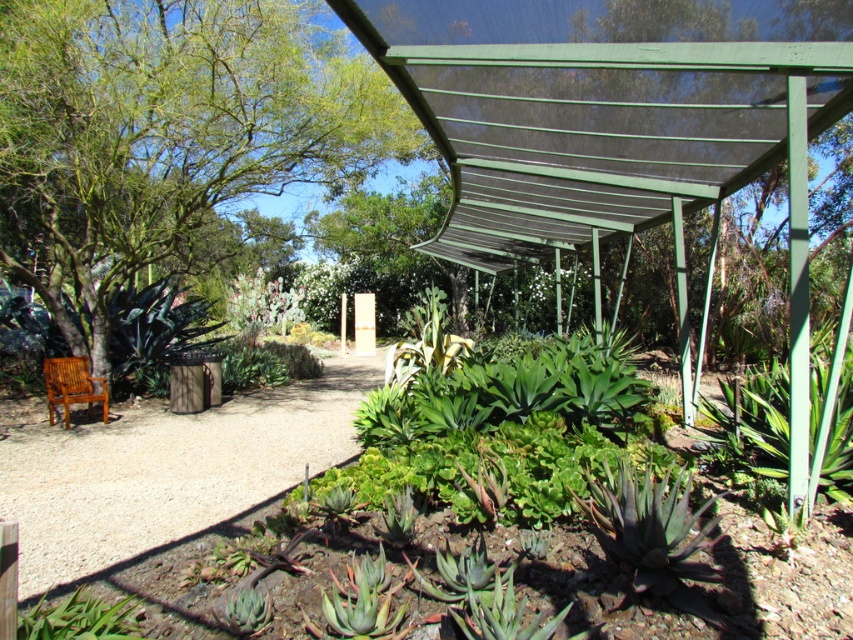
You are standing at the wooden bench on the left side of the garden and want to walk to the covered area in the midground. The path is marked by two points, point (19, 28) and point (86, 368). Which point should you step on first to stay on the correct path?

You should step on point (19, 28) first because it is closer to you than point (86, 368), ensuring you follow the correct path towards the covered area.